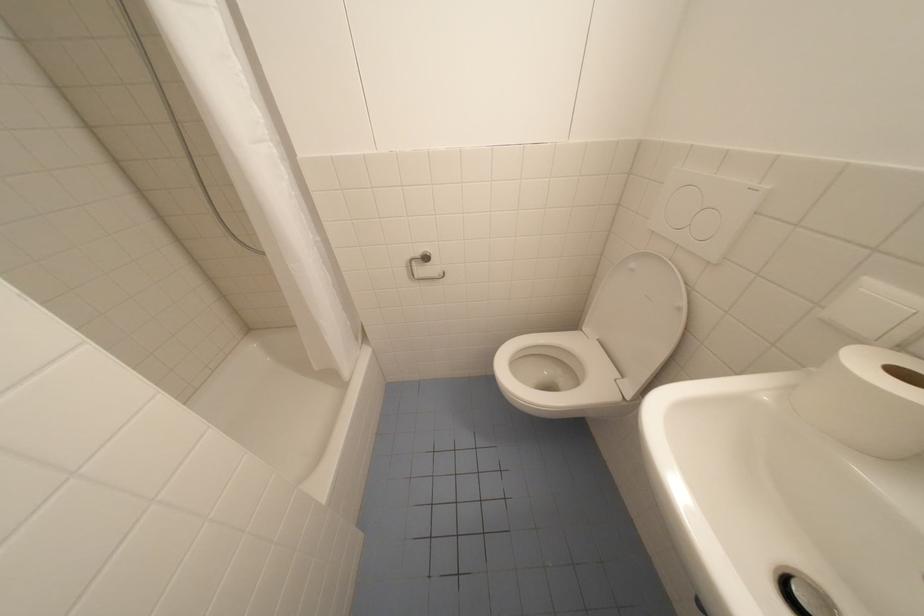
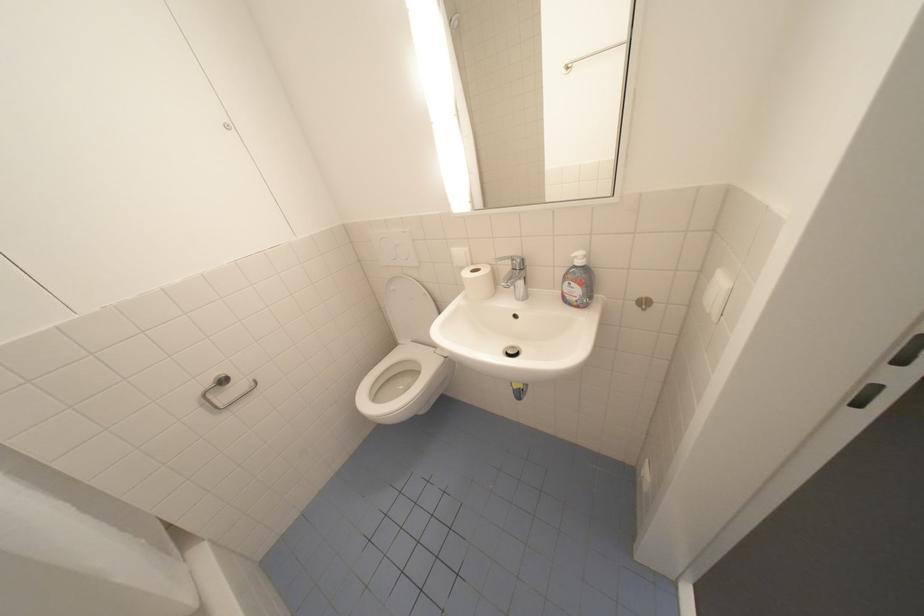
Question: The camera is either moving clockwise (left) or counter-clockwise (right) around the object. The first image is from the beginning of the video and the second image is from the end. Is the camera moving left or right when shooting the video?

Choices:
 (A) Left
 (B) Right

Answer: (A)